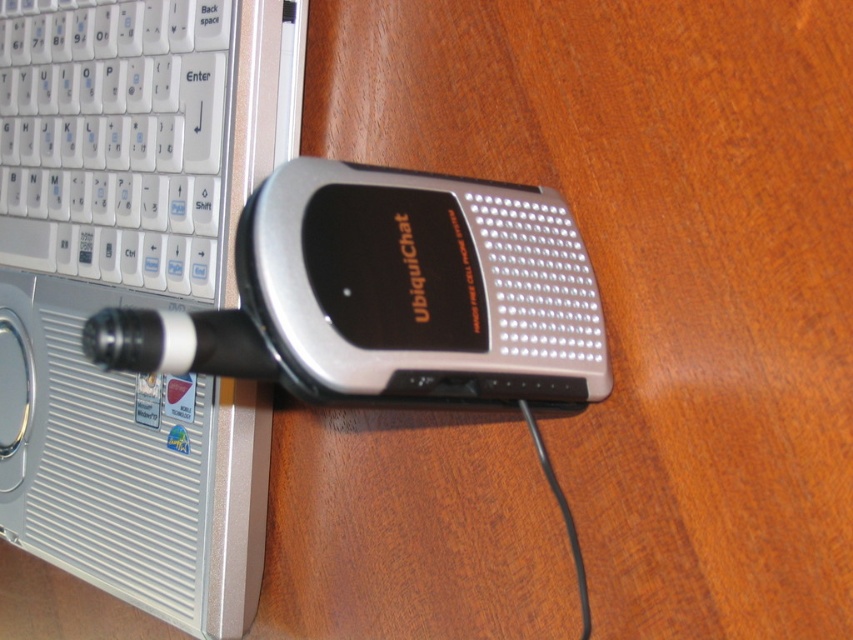
Question: Does silver metallic laptop at left appear on the right side of white plastic keyboard at upper left?

Choices:
 (A) yes
 (B) no

Answer: (A)

Question: Which point is farther to the camera?

Choices:
 (A) (189, 80)
 (B) (201, 61)

Answer: (A)

Question: Considering the relative positions of silver metallic laptop at left and white plastic keyboard at upper left in the image provided, where is silver metallic laptop at left located with respect to white plastic keyboard at upper left?

Choices:
 (A) right
 (B) left

Answer: (A)

Question: Among these objects, which one is nearest to the camera?

Choices:
 (A) silver metallic laptop at left
 (B) white plastic keyboard at upper left

Answer: (A)

Question: Which point is closer to the camera?

Choices:
 (A) (10, 237)
 (B) (157, 125)

Answer: (B)

Question: Where is silver metallic laptop at left located in relation to white plastic keyboard at upper left in the image?

Choices:
 (A) below
 (B) above

Answer: (A)